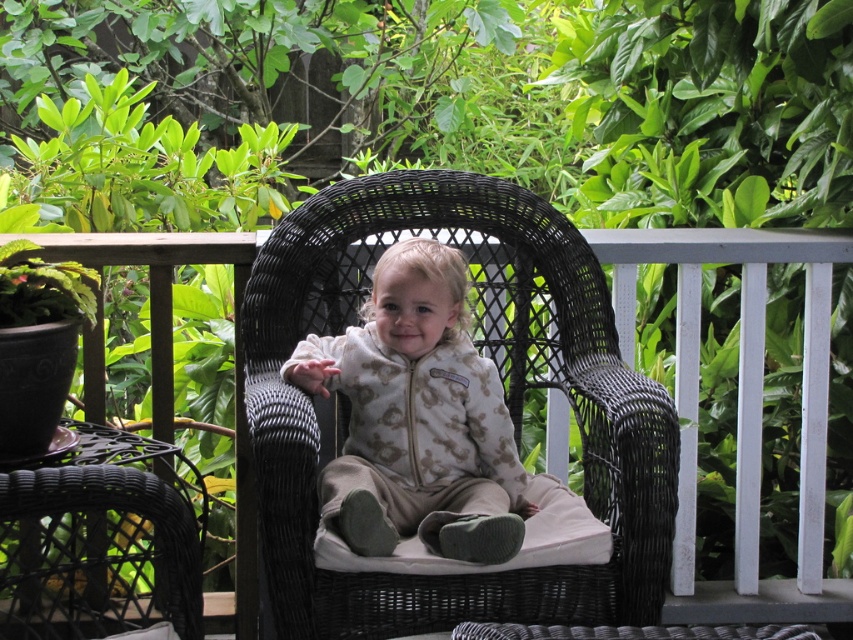
Who is higher up, black wicker armchair at center or black wicker chair at center?

Positioned higher is black wicker armchair at center.

Is black wicker armchair at center below black wicker chair at center?

Incorrect, black wicker armchair at center is not positioned below black wicker chair at center.

Is point (497, 186) closer to camera compared to point (757, 477)?

Yes, point (497, 186) is in front of point (757, 477).

Where is `black wicker armchair at center`? The image size is (853, 640). black wicker armchair at center is located at coordinates (505, 403).